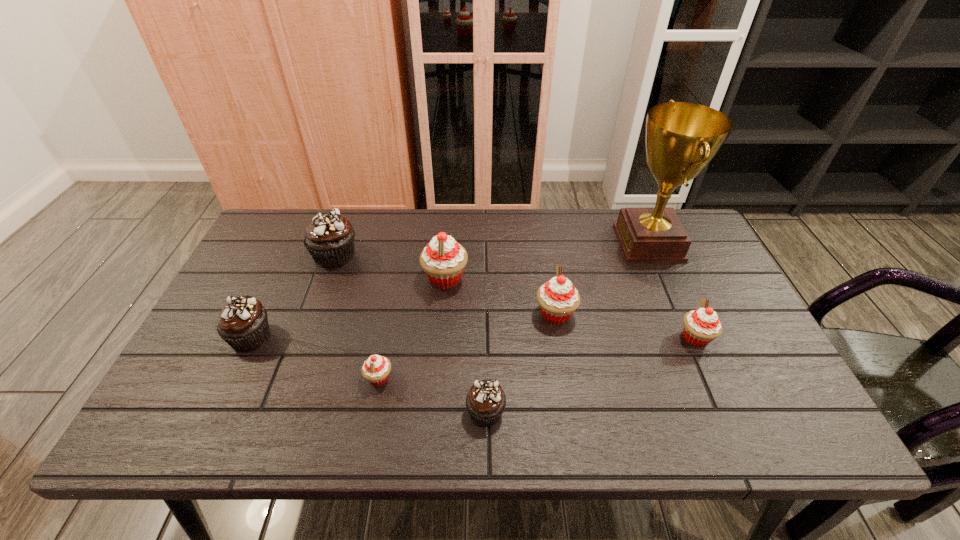
You are a GUI agent. You are given a task and a screenshot of the screen. Output one action in this format:
    pyautogui.click(x=<x>, y=<y>)
    Task: Click on the award that is at the right edge
    This screenshot has height=540, width=960.
    Given the screenshot: What is the action you would take?
    pyautogui.click(x=681, y=138)

Locate an element on the screen. The width and height of the screenshot is (960, 540). cupcake located at the right edge is located at coordinates (701, 326).

You are a GUI agent. You are given a task and a screenshot of the screen. Output one action in this format:
    pyautogui.click(x=<x>, y=<y>)
    Task: Click on the object located at the far right corner
    
    Given the screenshot: What is the action you would take?
    tap(681, 138)

This screenshot has width=960, height=540. I want to click on vacant space at the far edge of the desktop, so click(x=349, y=213).

In the image, there is a desktop. Identify the location of vacant area at the near edge. (311, 421).

Find the location of a particular element. Image resolution: width=960 pixels, height=540 pixels. blank space at the left edge of the desktop is located at coordinates (248, 294).

I want to click on free location at the right edge, so click(x=780, y=399).

In the image, there is a desktop. Identify the location of vacant space at the far left corner. The image size is (960, 540). (303, 223).

Where is `vacant space in between the farthest pink cupcake and the leftmost object`? vacant space in between the farthest pink cupcake and the leftmost object is located at coordinates (348, 307).

Find the location of a particular element. This screenshot has width=960, height=540. blank region between the rightmost cupcake and the sixth cupcake from left to right is located at coordinates (626, 326).